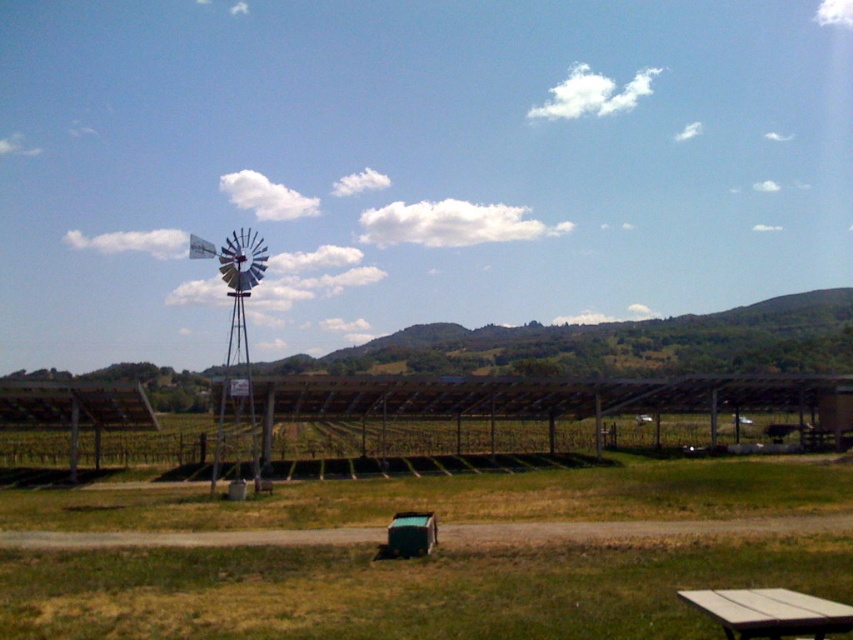
You are planning to set up a small garden in the rural landscape shown. You have a gardening tool that is 1.2 meters wide. Can you place it between the white plastic windmill at left and the wooden picnic table at lower right without it being too wide?

The white plastic windmill at left is wider than the wooden picnic table at lower right. Since the gardening tool is 1.2 meters wide, it may not fit if the space between them is narrower than 1.2 meters. However, the exact width of the space isn

You are standing at the center of the grassy area and want to walk to the white plastic windmill at left. Which direction should you face to head directly towards it?

You should face the left direction to head directly towards the white plastic windmill at left since it is located at point (236, 337), which is to the left of your current position at the center of the grassy area.